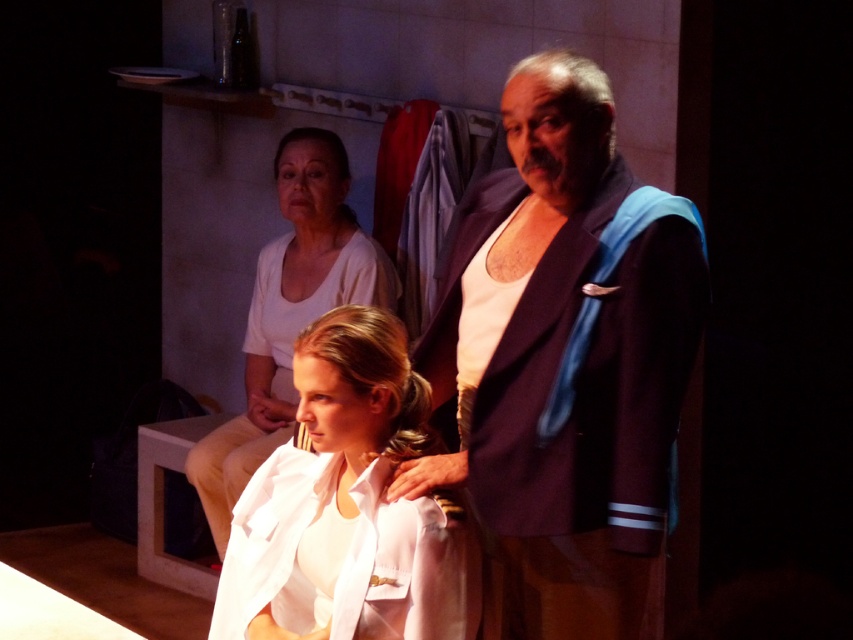
Does dark blue fabric jacket at center appear on the left side of smooth white blouse at center?

Incorrect, dark blue fabric jacket at center is not on the left side of smooth white blouse at center.

Where is `dark blue fabric jacket at center`? dark blue fabric jacket at center is located at coordinates (564, 356).

How far apart are white matte shirt at center and smooth white blouse at center?

The distance of white matte shirt at center from smooth white blouse at center is 4.53 feet.

Which of these two, white matte shirt at center or smooth white blouse at center, stands taller?

Result: With more height is smooth white blouse at center.

Who is more forward, [339,573] or [292,259]?

Point [339,573] is more forward.

Where is `white matte shirt at center`? white matte shirt at center is located at coordinates (349, 506).

Can you confirm if dark blue fabric jacket at center is smaller than white matte shirt at center?

Incorrect, dark blue fabric jacket at center is not smaller in size than white matte shirt at center.

In the scene shown: Is dark blue fabric jacket at center closer to camera compared to white matte shirt at center?

That is True.

Locate an element on the screen. Image resolution: width=853 pixels, height=640 pixels. dark blue fabric jacket at center is located at coordinates (564, 356).

Image resolution: width=853 pixels, height=640 pixels. In order to click on dark blue fabric jacket at center in this screenshot , I will do `click(564, 356)`.